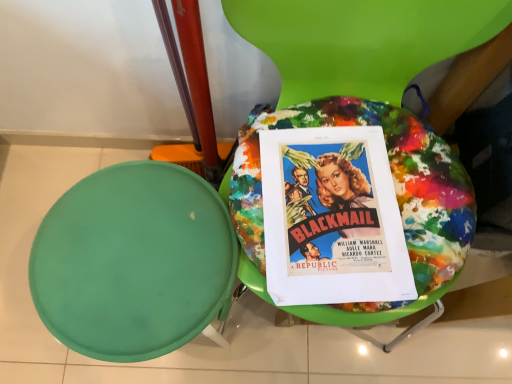
Question: From the image's perspective, is paint splattered fabric cushion at center positioned above or below vibrant paper poster at center?

Choices:
 (A) above
 (B) below

Answer: (A)

Question: Looking at their shapes, would you say paint splattered fabric cushion at center is wider or thinner than vibrant paper poster at center?

Choices:
 (A) wide
 (B) thin

Answer: (A)

Question: Which object is positioned closest to the paint splattered fabric cushion at center?

Choices:
 (A) green matte stool at left
 (B) vibrant paper poster at center

Answer: (B)

Question: Considering the real-world distances, which object is farthest from the paint splattered fabric cushion at center?

Choices:
 (A) green matte stool at left
 (B) vibrant paper poster at center

Answer: (A)